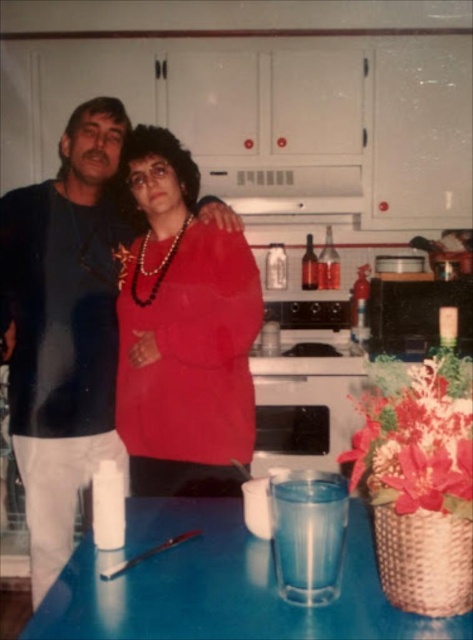
Question: Does matte black shirt at left have a greater width compared to white matte exhaust hood at upper center?

Choices:
 (A) no
 (B) yes

Answer: (A)

Question: Which of the following is the farthest from the observer?

Choices:
 (A) matte red sweater at center
 (B) white matte exhaust hood at upper center
 (C) blue plastic table at lower center
 (D) matte black shirt at left

Answer: (B)

Question: Observing the image, what is the correct spatial positioning of matte black shirt at left in reference to matte red sweater at center?

Choices:
 (A) above
 (B) below

Answer: (B)

Question: Which object is the farthest from the white matte exhaust hood at upper center?

Choices:
 (A) matte black shirt at left
 (B) matte red sweater at center
 (C) blue plastic table at lower center

Answer: (C)

Question: Which object is farther from the camera taking this photo?

Choices:
 (A) matte black shirt at left
 (B) white matte exhaust hood at upper center
 (C) blue plastic table at lower center
 (D) matte red sweater at center

Answer: (B)

Question: Can you confirm if matte black shirt at left is positioned above white matte exhaust hood at upper center?

Choices:
 (A) yes
 (B) no

Answer: (B)